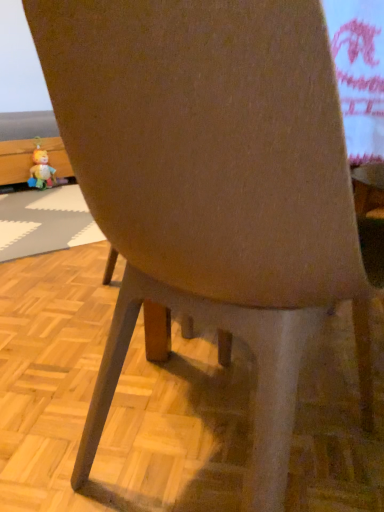
Question: Does plush yellow toy at left lie in front of white rubber place mat at lower left?

Choices:
 (A) no
 (B) yes

Answer: (A)

Question: Is plush yellow toy at left at the left side of white rubber place mat at lower left?

Choices:
 (A) no
 (B) yes

Answer: (B)

Question: From a real-world perspective, is plush yellow toy at left physically above white rubber place mat at lower left?

Choices:
 (A) yes
 (B) no

Answer: (A)

Question: Is plush yellow toy at left shorter than white rubber place mat at lower left?

Choices:
 (A) yes
 (B) no

Answer: (B)

Question: Would you say plush yellow toy at left is outside white rubber place mat at lower left?

Choices:
 (A) yes
 (B) no

Answer: (A)

Question: From the image's perspective, is plush yellow toy at left located beneath white rubber place mat at lower left?

Choices:
 (A) yes
 (B) no

Answer: (B)

Question: Is white rubber place mat at lower left oriented towards plush yellow toy at left?

Choices:
 (A) no
 (B) yes

Answer: (A)

Question: Can you confirm if white rubber place mat at lower left is shorter than plush yellow toy at left?

Choices:
 (A) yes
 (B) no

Answer: (A)

Question: Considering the relative positions of white rubber place mat at lower left and plush yellow toy at left in the image provided, is white rubber place mat at lower left to the right of plush yellow toy at left from the viewer's perspective?

Choices:
 (A) no
 (B) yes

Answer: (B)

Question: Can you confirm if white rubber place mat at lower left is thinner than plush yellow toy at left?

Choices:
 (A) yes
 (B) no

Answer: (B)

Question: Is white rubber place mat at lower left turned away from plush yellow toy at left?

Choices:
 (A) yes
 (B) no

Answer: (B)

Question: Considering the relative sizes of white rubber place mat at lower left and plush yellow toy at left in the image provided, is white rubber place mat at lower left smaller than plush yellow toy at left?

Choices:
 (A) yes
 (B) no

Answer: (B)

Question: From the image's perspective, is plush yellow toy at left located above or below white rubber place mat at lower left?

Choices:
 (A) above
 (B) below

Answer: (A)